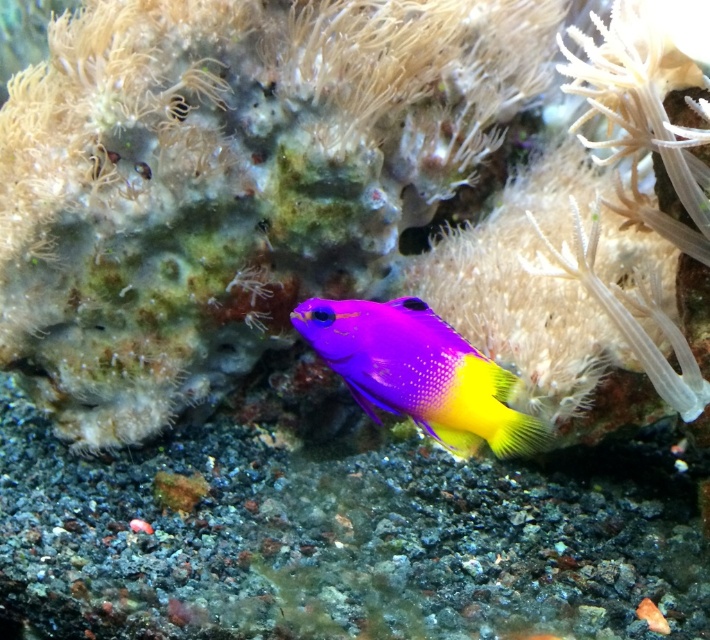
Measure the distance from purple glossy fish at center to translucent white anemone at upper right.

The distance of purple glossy fish at center from translucent white anemone at upper right is 15.78 inches.

From the picture: Measure the distance between purple glossy fish at center and translucent white anemone at upper right.

15.78 inches

Identify the location of purple glossy fish at center. (420, 372).

At what (x,y) coordinates should I click in order to perform the action: click on purple glossy fish at center. Please return your answer as a coordinate pair (x, y). This screenshot has height=640, width=710. Looking at the image, I should click on tap(420, 372).